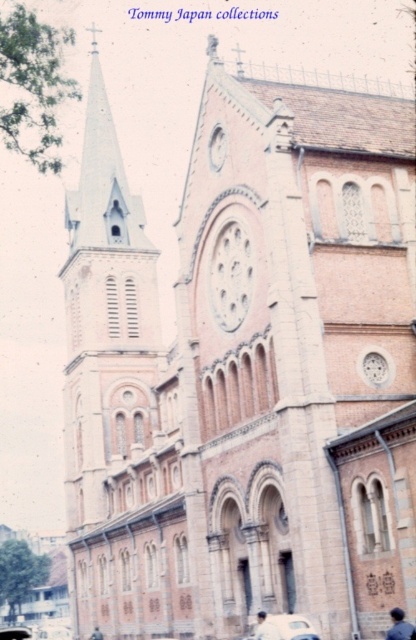
This screenshot has width=416, height=640. What do you see at coordinates (282, 627) in the screenshot?
I see `white matte car at lower center` at bounding box center [282, 627].

Between white matte car at lower center and dark blue fabric at lower right, which one appears on the right side from the viewer's perspective?

Positioned to the right is dark blue fabric at lower right.

Find the location of a particular element. white matte car at lower center is located at coordinates (282, 627).

This screenshot has height=640, width=416. What are the coordinates of `white matte car at lower center` in the screenshot? It's located at (282, 627).

Who is more forward, (287, 624) or (272, 630)?

Point (272, 630) is in front.

Find the location of a particular element. The height and width of the screenshot is (640, 416). white matte car at lower center is located at coordinates (282, 627).

How much distance is there between white matte shirt at center and dark brown leather jacket at lower center?

white matte shirt at center and dark brown leather jacket at lower center are 37.69 meters apart from each other.

Which is behind, point (274, 632) or point (98, 632)?

Positioned behind is point (98, 632).

What are the coordinates of `white matte shirt at center` in the screenshot? It's located at (265, 627).